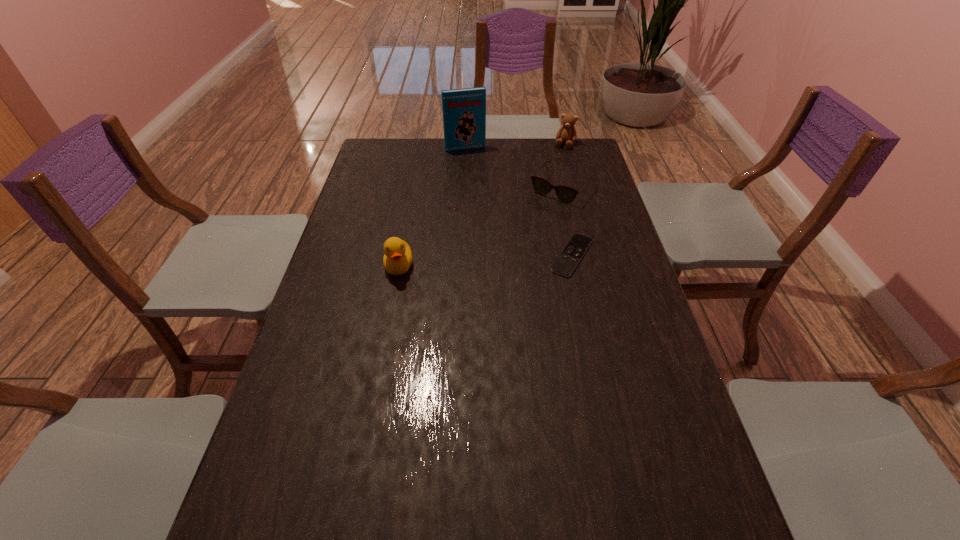
Where is `vacant space located on the face of the teddy bear`? vacant space located on the face of the teddy bear is located at coordinates (550, 175).

Where is `free location located 0.240m on the face of the teddy bear`? The width and height of the screenshot is (960, 540). free location located 0.240m on the face of the teddy bear is located at coordinates point(547,180).

I want to click on vacant region located 0.220m at the front view of the spectacles, so click(x=516, y=238).

Image resolution: width=960 pixels, height=540 pixels. Find the location of `vacant space located 0.090m at the front view of the spectacles`. vacant space located 0.090m at the front view of the spectacles is located at coordinates (535, 217).

Locate an element on the screen. The height and width of the screenshot is (540, 960). vacant space situated 0.400m at the front view of the spectacles is located at coordinates (486, 272).

Image resolution: width=960 pixels, height=540 pixels. In order to click on vacant space situated 0.160m on the front cover of the tallest object in this screenshot , I will do `click(478, 173)`.

I want to click on vacant area located 0.310m on the front cover of the tallest object, so click(487, 195).

Where is `free space located 0.170m on the front cover of the tallest object`? This screenshot has width=960, height=540. free space located 0.170m on the front cover of the tallest object is located at coordinates (478, 174).

You are a GUI agent. You are given a task and a screenshot of the screen. Output one action in this format:
    pyautogui.click(x=<x>, y=<y>)
    Task: Click on the teddy bear at the far edge
    
    Given the screenshot: What is the action you would take?
    pyautogui.click(x=567, y=133)

At what (x,y) coordinates should I click in order to perform the action: click on book that is at the far edge. Please return your answer as a coordinate pair (x, y). The height and width of the screenshot is (540, 960). Looking at the image, I should click on (464, 110).